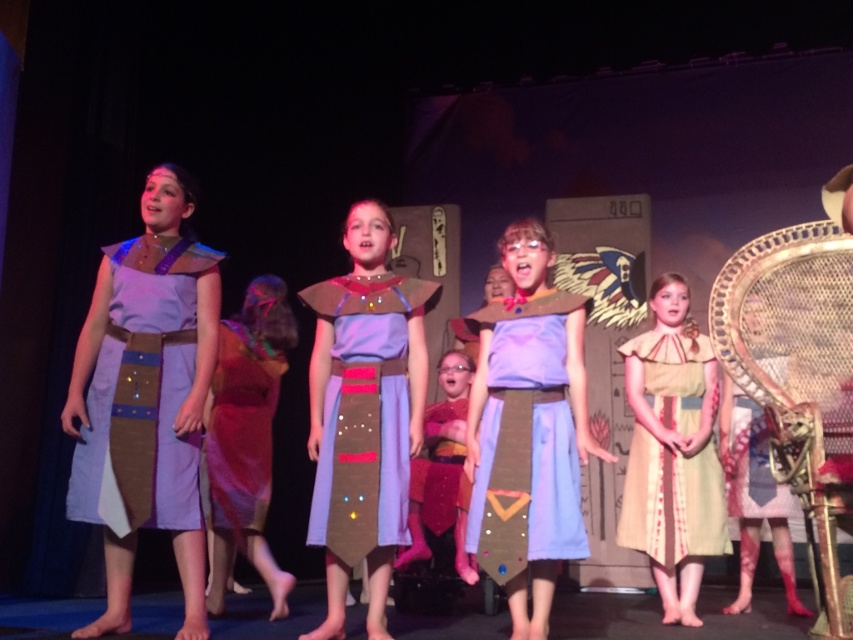
You are a photographer in the audience taking pictures of the performance. You want to capture both the light blue fabric dress at center and the shiny orange dress at center in the same frame. Which dress should you position on the left side of your camera frame to ensure both are visible?

To capture both the light blue fabric dress at center and the shiny orange dress at center in the same frame, position the shiny orange dress at center on the left side of your camera frame. This is because the light blue fabric dress at center is already on the right side of the shiny orange dress at center, so aligning the orange dress to the left will allow both to fit within the frame.

Looking at this image, you are a photographer in the audience watching the children perform. You want to take a clear photo of both the light brown fabric dress at center and the shiny orange dress at center. Which dress should you focus on to ensure both are in focus?

You should focus on the light brown fabric dress at center because it is in front of the shiny orange dress at center, so focusing on the front one will help both be in focus.